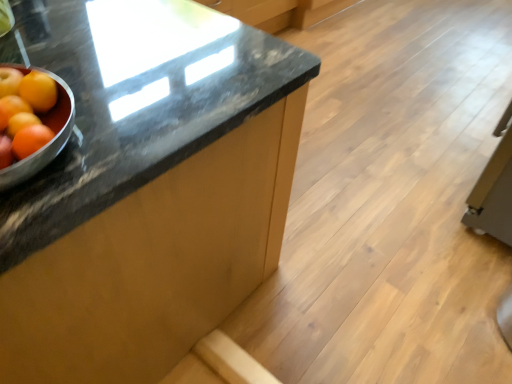
Question: Looking at their shapes, would you say orange matte at left is wider or thinner than orange matte grapefruit at left?

Choices:
 (A) wide
 (B) thin

Answer: (B)

Question: Is orange matte at left taller or shorter than orange matte grapefruit at left?

Choices:
 (A) tall
 (B) short

Answer: (A)

Question: Based on their relative distances, which object is farther from the orange matte at left?

Choices:
 (A) orange matte grapefruit at left
 (B) black granite countertop at center
 (C) orange matte at left

Answer: (B)

Question: Which of these objects is positioned farthest from the orange matte grapefruit at left?

Choices:
 (A) black granite countertop at center
 (B) orange matte at left
 (C) orange matte at left

Answer: (A)